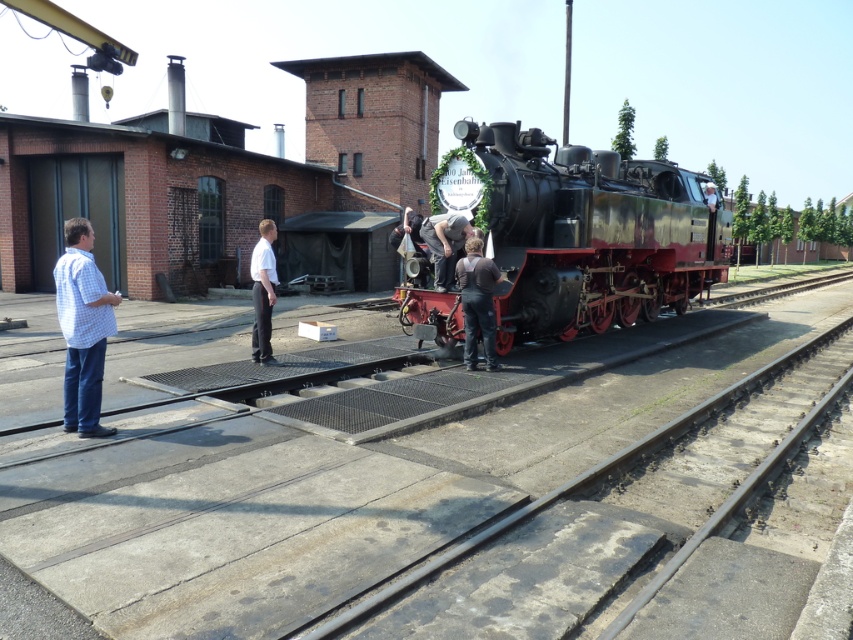
Question: Based on their relative distances, which object is nearer to the checkered shirt at left?

Choices:
 (A) dark brown leather jacket at center
 (B) shiny black locomotive at center

Answer: (A)

Question: Does shiny black locomotive at center have a lesser width compared to checkered shirt at left?

Choices:
 (A) yes
 (B) no

Answer: (B)

Question: Which object appears closest to the camera in this image?

Choices:
 (A) dark brown leather jacket at center
 (B) shiny black locomotive at center
 (C) dark gray fabric pants at center

Answer: (A)

Question: Is checkered shirt at left bigger than dark gray fabric pants at center?

Choices:
 (A) no
 (B) yes

Answer: (B)

Question: Among these objects, which one is farthest from the camera?

Choices:
 (A) dark gray fabric pants at center
 (B) shiny black locomotive at center

Answer: (A)

Question: Does shiny black locomotive at center lie behind checkered shirt at left?

Choices:
 (A) no
 (B) yes

Answer: (B)